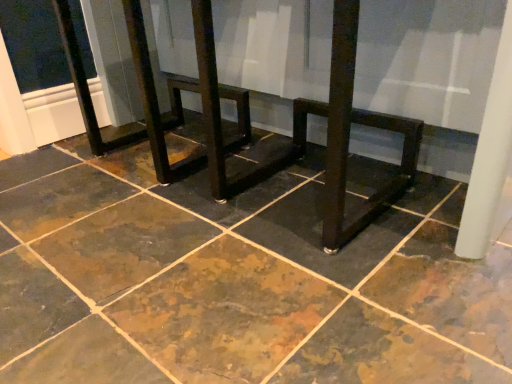
In order to click on free space in front of matte dark wood table at center in this screenshot , I will do `click(330, 294)`.